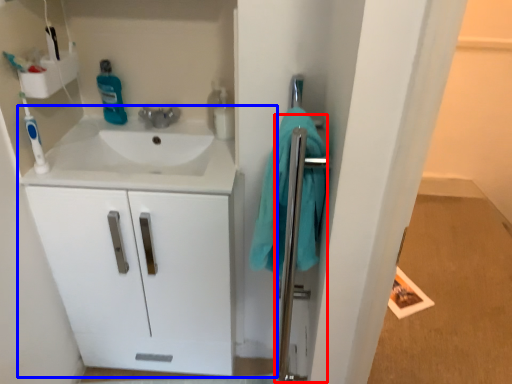
Question: Which object is closer to the camera taking this photo, shower door (highlighted by a red box) or bathroom cabinet (highlighted by a blue box)?

Choices:
 (A) shower door
 (B) bathroom cabinet

Answer: (A)